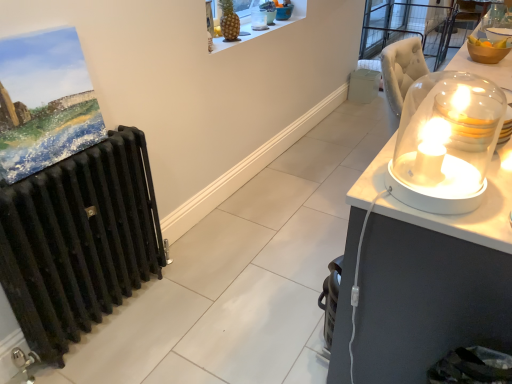
Question: Considering the relative sizes of translucent glass candle at right, which is the 2th candle holder in front-to-back order, and golden pineapple at upper center in the image provided, is translucent glass candle at right, which is the 2th candle holder in front-to-back order, smaller than golden pineapple at upper center?

Choices:
 (A) no
 (B) yes

Answer: (A)

Question: Does translucent glass candle at right, the second candle holder in the right-to-left sequence, come in front of golden pineapple at upper center?

Choices:
 (A) no
 (B) yes

Answer: (B)

Question: From the image's perspective, is translucent glass candle at right, which ranks as the 3th candle holder in left-to-right order, below golden pineapple at upper center?

Choices:
 (A) yes
 (B) no

Answer: (A)

Question: Is translucent glass candle at right, placed as the third candle holder when sorted from back to front, turned away from golden pineapple at upper center?

Choices:
 (A) no
 (B) yes

Answer: (B)

Question: Is translucent glass candle at right, which ranks as the 3th candle holder in top-to-bottom order, not within golden pineapple at upper center?

Choices:
 (A) yes
 (B) no

Answer: (A)

Question: From a real-world perspective, relative to matte acrylic painting at left, is translucent glass dome at upper center, the 1th candle holder viewed from the top, vertically above or below?

Choices:
 (A) above
 (B) below

Answer: (A)

Question: Considering the relative positions of translucent glass dome at upper center, the first candle holder positioned from the back, and matte acrylic painting at left in the image provided, is translucent glass dome at upper center, the first candle holder positioned from the back, to the left or to the right of matte acrylic painting at left?

Choices:
 (A) left
 (B) right

Answer: (B)

Question: In terms of size, does translucent glass dome at upper center, the 1th candle holder viewed from the top, appear bigger or smaller than matte acrylic painting at left?

Choices:
 (A) big
 (B) small

Answer: (B)

Question: Is point (266, 16) closer or farther from the camera than point (3, 129)?

Choices:
 (A) farther
 (B) closer

Answer: (A)

Question: From a real-world perspective, is white glossy candle holder at right, the fourth candle holder when ordered from top to bottom, physically located above or below golden pineapple at upper center?

Choices:
 (A) below
 (B) above

Answer: (A)

Question: Considering the positions of point (404, 162) and point (227, 41), is point (404, 162) closer or farther from the camera than point (227, 41)?

Choices:
 (A) closer
 (B) farther

Answer: (A)

Question: From the image's perspective, is white glossy candle holder at right, which appears as the fourth candle holder when viewed from the back, above or below golden pineapple at upper center?

Choices:
 (A) below
 (B) above

Answer: (A)

Question: Is white glossy candle holder at right, which is counted as the first candle holder, starting from the bottom, situated inside golden pineapple at upper center or outside?

Choices:
 (A) inside
 (B) outside

Answer: (B)

Question: Considering their positions, is translucent glass dome at upper center, which appears as the fourth candle holder when viewed from the right, located in front of or behind translucent glass dome at upper right, which appears as the 3th candle holder when viewed from the front?

Choices:
 (A) front
 (B) behind

Answer: (B)

Question: Would you say translucent glass dome at upper center, which is the 4th candle holder from front to back, is to the left or to the right of translucent glass dome at upper right, positioned as the second candle holder in top-to-bottom order, in the picture?

Choices:
 (A) right
 (B) left

Answer: (B)